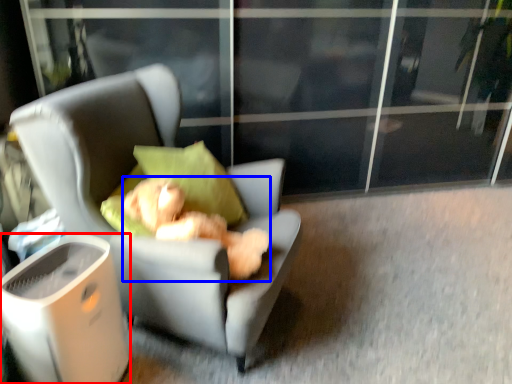
Question: Among these objects, which one is farthest to the camera, trash bin/can (highlighted by a red box) or teddy bear (highlighted by a blue box)?

Choices:
 (A) trash bin/can
 (B) teddy bear

Answer: (B)